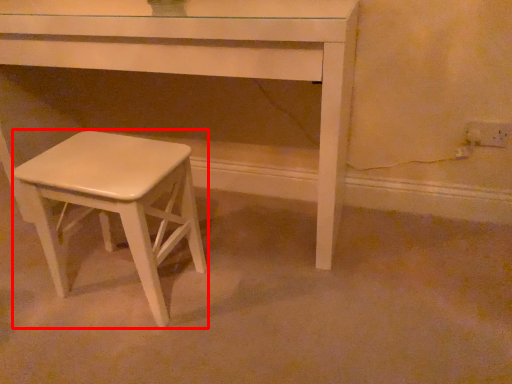
Question: From the image's perspective, where is stool (annotated by the red box) located in relation to table in the image?

Choices:
 (A) below
 (B) above

Answer: (A)